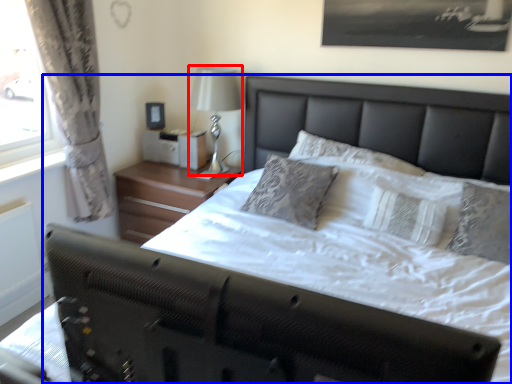
Question: Which of the following is the closest to the observer, bedside lamp (highlighted by a red box) or bed (highlighted by a blue box)?

Choices:
 (A) bedside lamp
 (B) bed

Answer: (B)